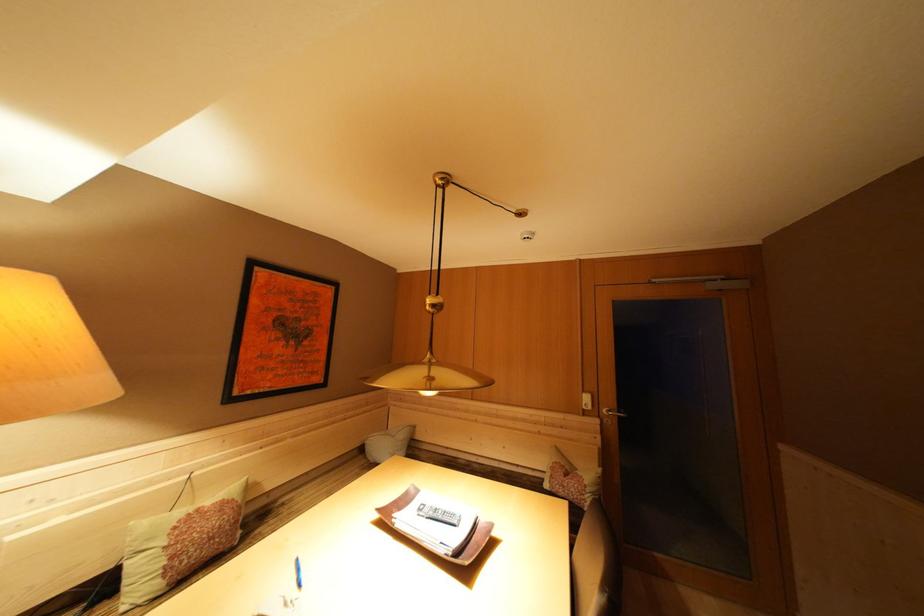
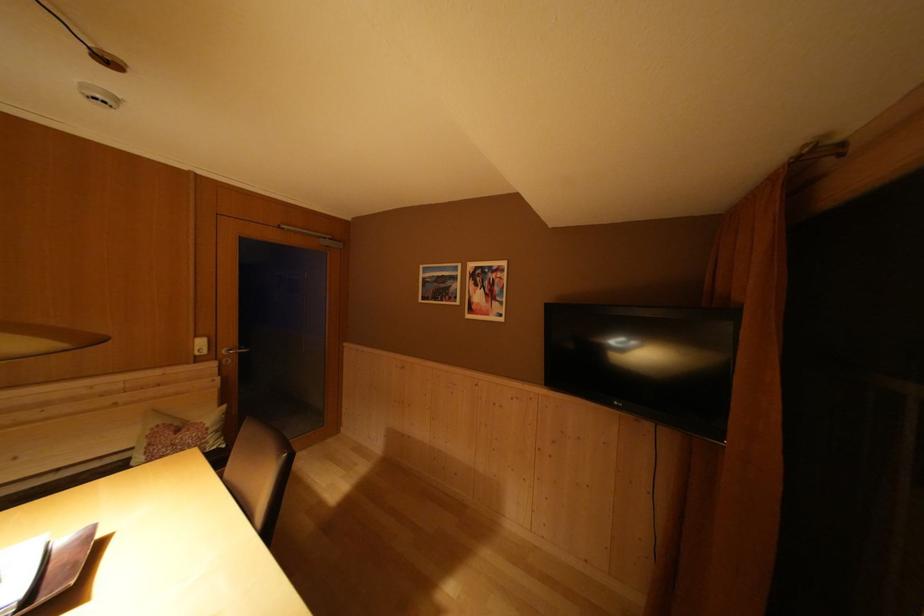
Where in the second image is the point corresponding to [525,471] from the first image?

(66, 475)